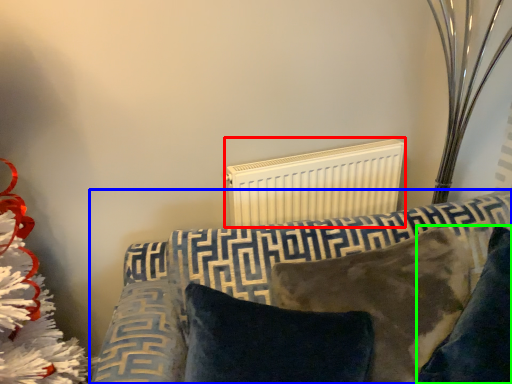
Question: Which object is positioned farthest from radiator (highlighted by a red box)? Select from furniture (highlighted by a blue box) and pillow (highlighted by a green box).

Choices:
 (A) furniture
 (B) pillow

Answer: (B)